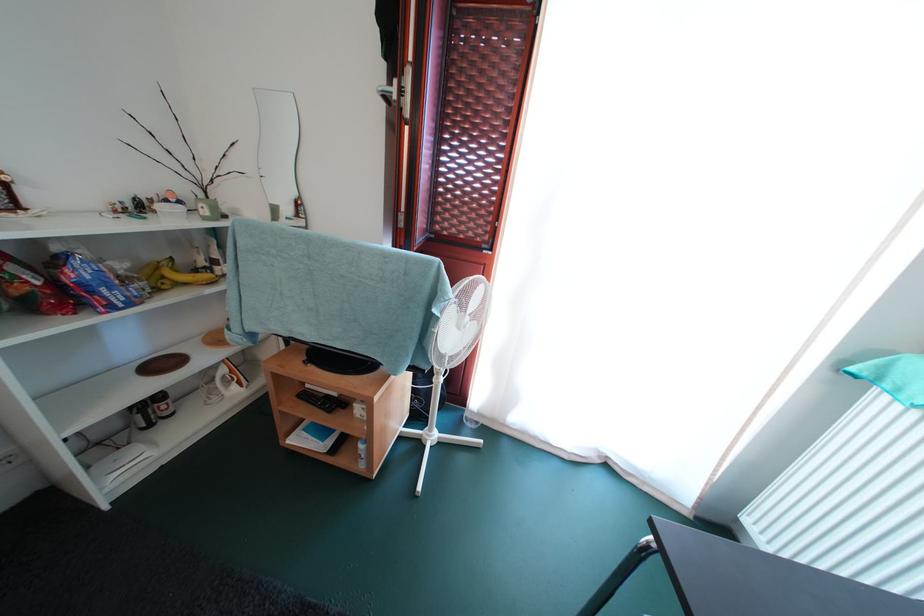
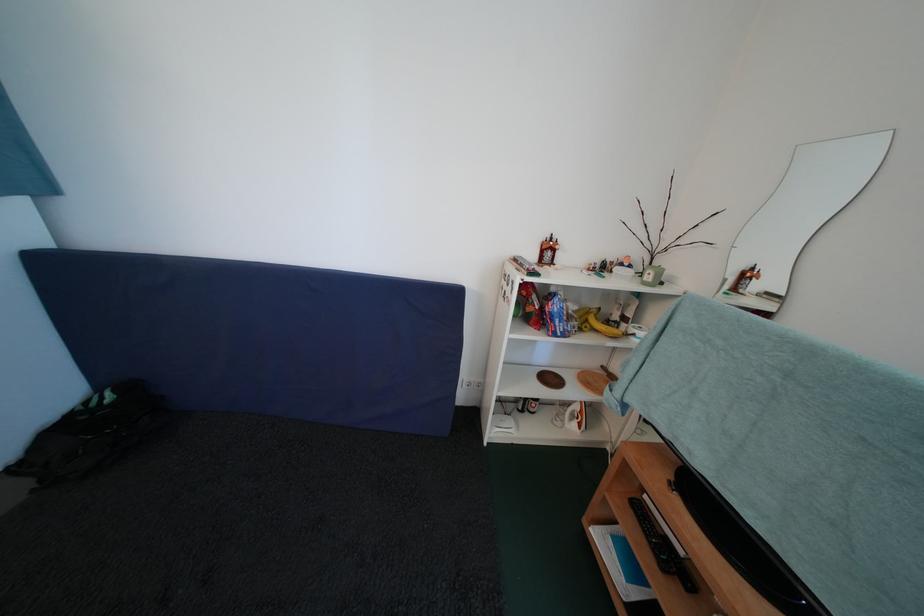
Find the pixel in the second image that matches point 128,270 in the first image.

(579, 313)